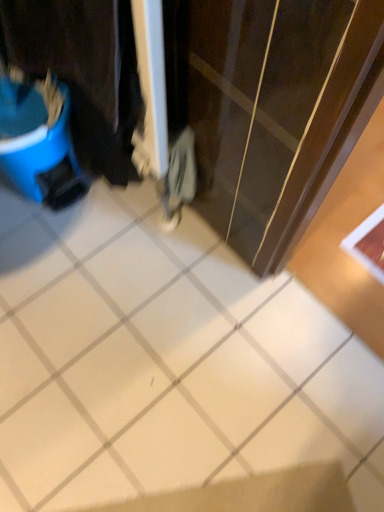
Find the location of a particular element. free space above white glossy tile at center (from a real-world perspective) is located at coordinates (144, 343).